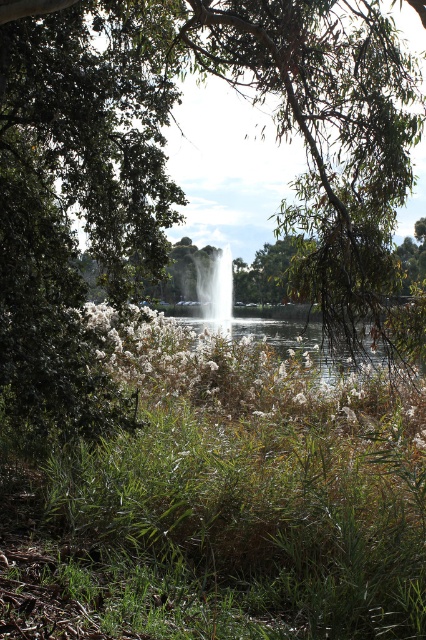
Question: Which is farther from the green leafy tree at left?

Choices:
 (A) green grass at center
 (B) clear water at center

Answer: (A)

Question: Which point is closer to the camera taking this photo?

Choices:
 (A) (218, 284)
 (B) (0, 102)
 (C) (176, 561)

Answer: (C)

Question: Where is green leafy tree at left located in relation to white glossy fountain at center in the image?

Choices:
 (A) below
 (B) above

Answer: (B)

Question: Can you confirm if green leafy tree at center is thinner than clear water at center?

Choices:
 (A) yes
 (B) no

Answer: (A)

Question: Which of the following is the closest to the observer?

Choices:
 (A) green leafy tree at center
 (B) clear water at center

Answer: (B)

Question: Is green grass at center above green leafy tree at center?

Choices:
 (A) no
 (B) yes

Answer: (A)